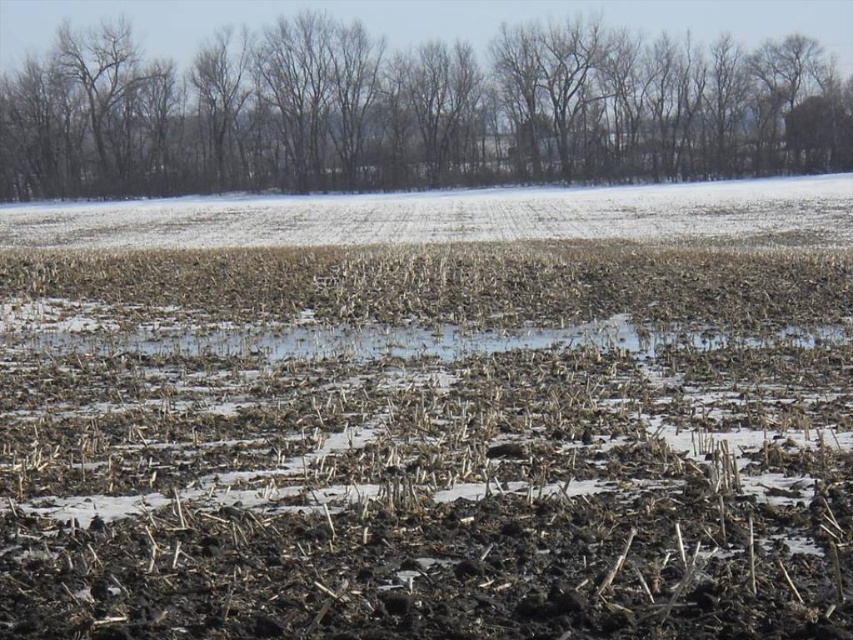
Is brown soil at center bigger than brown leafless trees at upper center?

Indeed, brown soil at center has a larger size compared to brown leafless trees at upper center.

Measure the distance from brown soil at center to brown leafless trees at upper center.

brown soil at center is 35.03 meters from brown leafless trees at upper center.

Which is in front, point (161, 582) or point (328, 186)?

Point (161, 582)

Locate an element on the screen. This screenshot has width=853, height=640. brown soil at center is located at coordinates (430, 416).